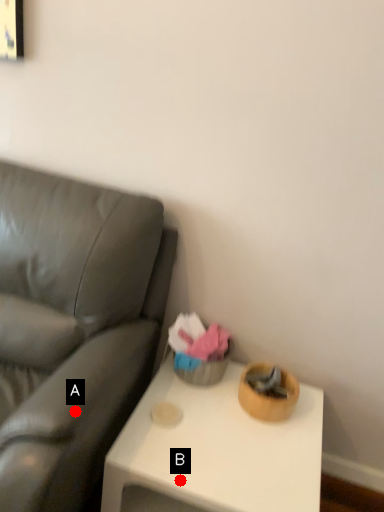
Question: Two points are circled on the image, labeled by A and B beside each circle. Which point appears farthest from the camera in this image?

Choices:
 (A) A is further
 (B) B is further

Answer: (B)